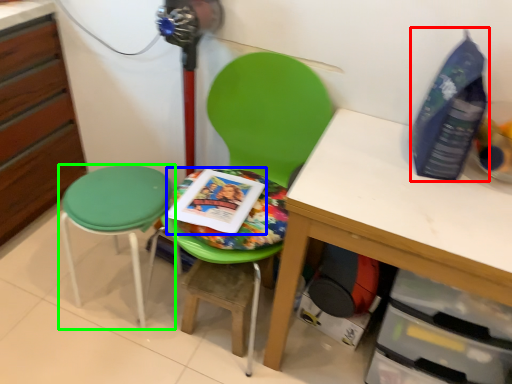
Question: Which object is positioned farthest from bottle (highlighted by a red box)? Select from paperback book (highlighted by a blue box) and stool (highlighted by a green box).

Choices:
 (A) paperback book
 (B) stool

Answer: (B)